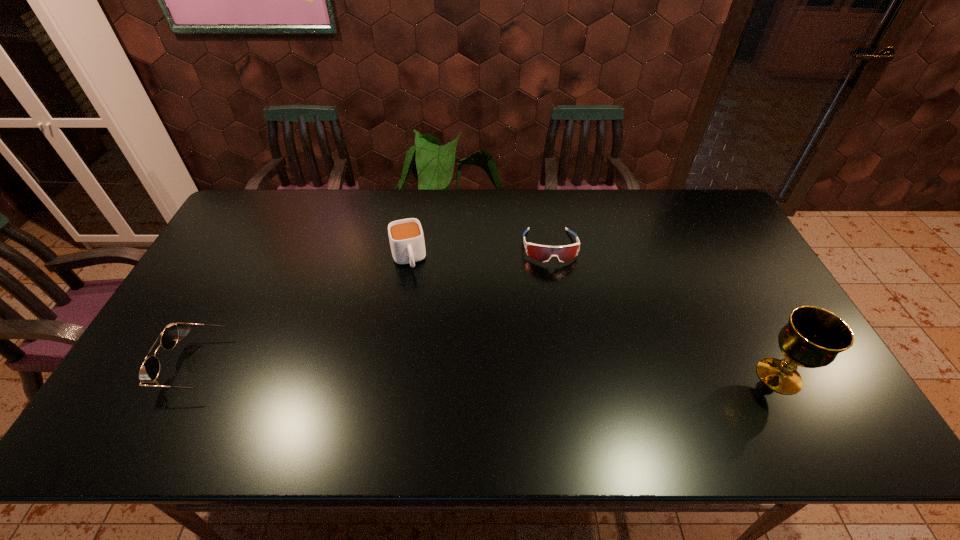
Find the location of a particular element. The height and width of the screenshot is (540, 960). object located at the near left corner is located at coordinates (149, 371).

Where is `object that is at the near right corner`? The width and height of the screenshot is (960, 540). object that is at the near right corner is located at coordinates (813, 337).

Find the location of a particular element. Image resolution: width=960 pixels, height=540 pixels. vacant area at the far edge of the desktop is located at coordinates (494, 190).

Identify the location of free space at the near edge. The height and width of the screenshot is (540, 960). (489, 395).

Identify the location of vacant space at the right edge of the desktop. This screenshot has height=540, width=960. (722, 260).

This screenshot has width=960, height=540. I want to click on free point at the far left corner, so click(x=242, y=207).

At what (x,y) coordinates should I click in order to perform the action: click on free point between the second object from left to right and the rightmost object. Please return your answer as a coordinate pair (x, y). Looking at the image, I should click on (593, 318).

Identify the location of free point between the second object from left to right and the leftmost object. This screenshot has width=960, height=540. (305, 313).

At what (x,y) coordinates should I click in order to perform the action: click on free space between the sunglasses and the third object from right to left. Please return your answer as a coordinate pair (x, y). This screenshot has width=960, height=540. Looking at the image, I should click on (305, 313).

The image size is (960, 540). I want to click on vacant region between the cup and the goggles, so click(x=479, y=253).